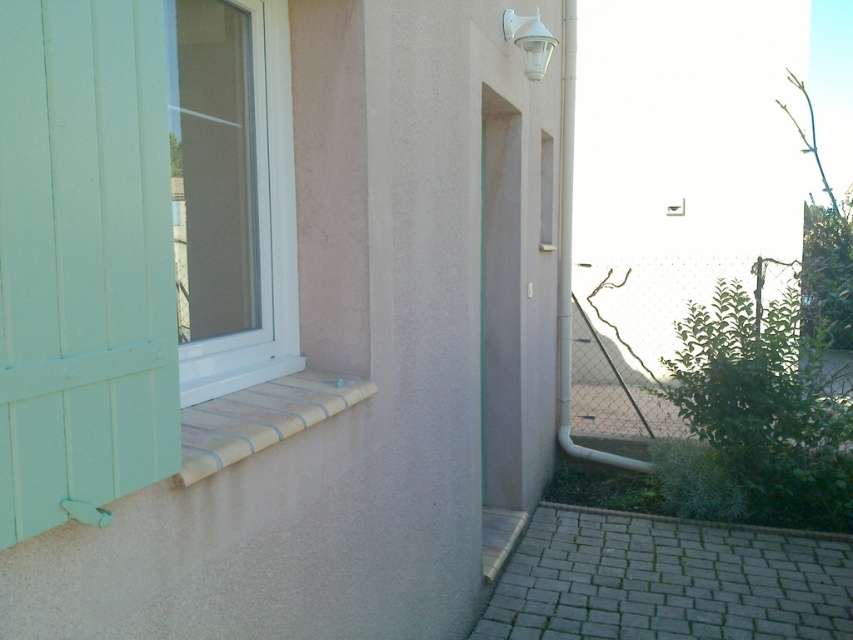
Does point (218, 230) lie in front of point (323, 372)?

Yes, point (218, 230) is in front of point (323, 372).

Between white plastic window at left and brown textured stone at lower left, which one has more height?

white plastic window at left is taller.

You are a GUI agent. You are given a task and a screenshot of the screen. Output one action in this format:
    pyautogui.click(x=<x>, y=<y>)
    Task: Click on the white plastic window at left
    The image size is (853, 640).
    Given the screenshot: What is the action you would take?
    [x=231, y=193]

This screenshot has height=640, width=853. In order to click on white plastic window at left in this screenshot , I will do `click(231, 193)`.

Between transparent plastic screen door at center and brown textured stone at lower left, which one appears on the right side from the viewer's perspective?

Positioned to the right is transparent plastic screen door at center.

Is point (509, 131) farther from viewer compared to point (192, 448)?

Yes, point (509, 131) is behind point (192, 448).

Locate an element on the screen. This screenshot has height=640, width=853. transparent plastic screen door at center is located at coordinates pyautogui.click(x=500, y=301).

Is mint wood shutter at left below white plastic window at left?

Yes, mint wood shutter at left is below white plastic window at left.

Is mint wood shutter at left taller than white plastic window at left?

In fact, mint wood shutter at left may be shorter than white plastic window at left.

Find the location of a particular element. The image size is (853, 640). mint wood shutter at left is located at coordinates (83, 259).